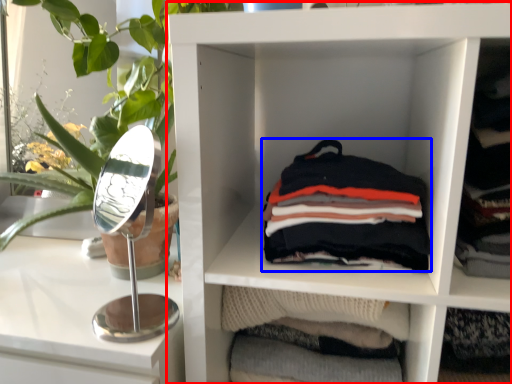
Question: Which of the following is the closest to the observer, shelf (highlighted by a red box) or material (highlighted by a blue box)?

Choices:
 (A) shelf
 (B) material

Answer: (A)